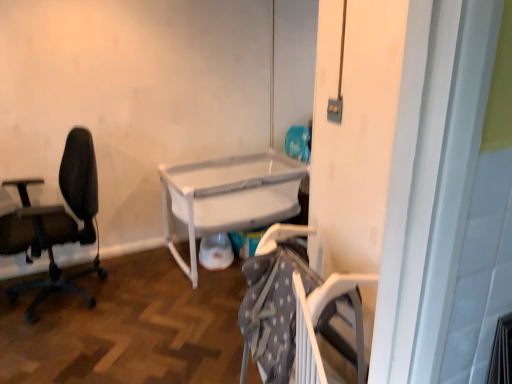
You are a GUI agent. You are given a task and a screenshot of the screen. Output one action in this format:
    pyautogui.click(x=<x>, y=<y>)
    Task: Click on the vacant space underneath black mesh office chair at left (from a real-world perspective)
    The height and width of the screenshot is (384, 512).
    Given the screenshot: What is the action you would take?
    pyautogui.click(x=50, y=301)